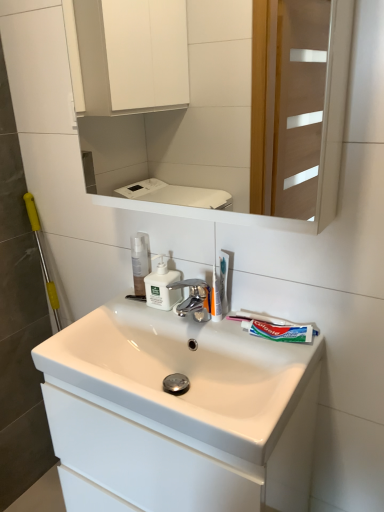
Image resolution: width=384 pixels, height=512 pixels. Identify the location of vacant space that is to the left of translucent plastic toothbrush at center. (171, 317).